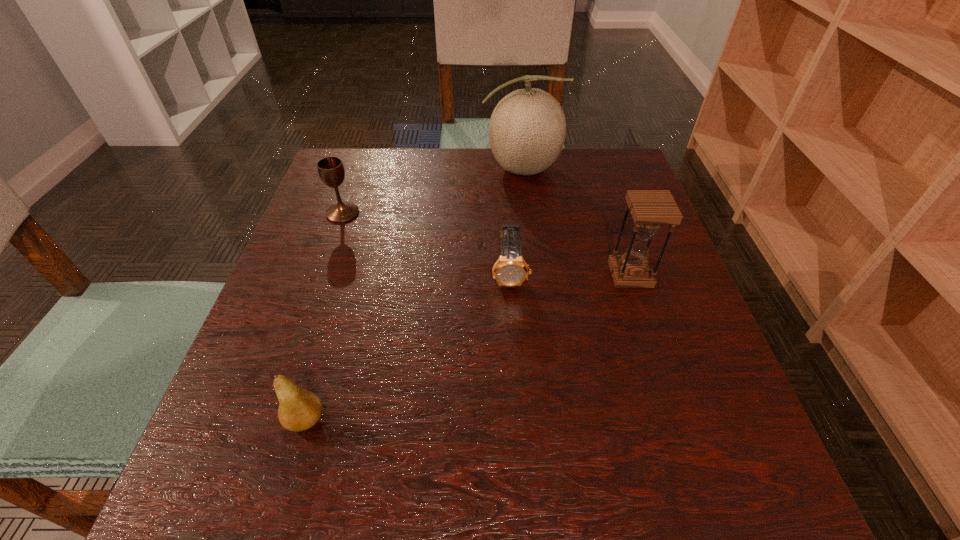
This screenshot has width=960, height=540. I want to click on the tallest object, so click(x=527, y=130).

Find the location of a particular element. the farthest object is located at coordinates (527, 130).

At what (x,y) coordinates should I click in order to perform the action: click on the fourth shortest object. Please return your answer as a coordinate pair (x, y). Looking at the image, I should click on (651, 209).

Locate an element on the screen. The width and height of the screenshot is (960, 540). the rightmost object is located at coordinates (651, 209).

The width and height of the screenshot is (960, 540). Identify the location of chalice. (331, 170).

Identify the location of watch. This screenshot has width=960, height=540. (510, 269).

Identify the location of the nearest object. This screenshot has width=960, height=540. (299, 409).

Identify the location of free space located 0.170m on the left of the tallest object. The height and width of the screenshot is (540, 960). (419, 169).

Locate an element on the screen. The image size is (960, 540). vacant space situated on the back of the hourglass is located at coordinates (604, 195).

Locate an element on the screen. free space located 0.210m on the back of the chalice is located at coordinates (362, 158).